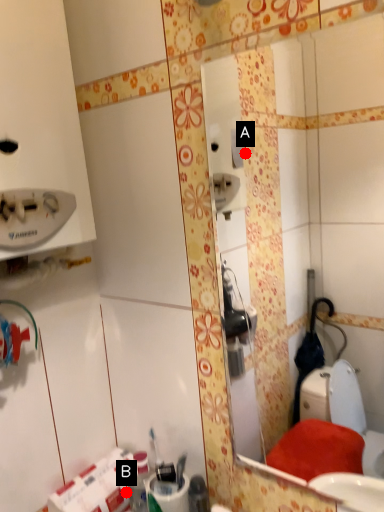
Question: Two points are circled on the image, labeled by A and B beside each circle. Which of the following is the farthest from the observer?

Choices:
 (A) A is further
 (B) B is further

Answer: (A)